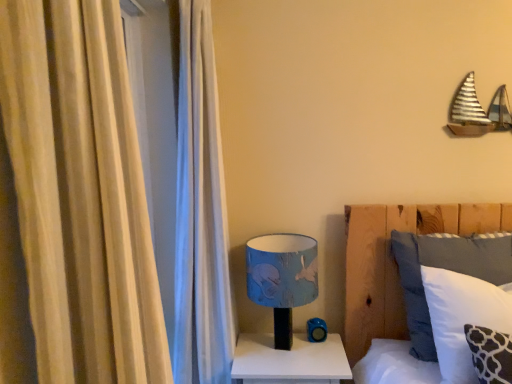
Question: Would you say white glossy nightstand at lower center contains white soft pillow at center?

Choices:
 (A) no
 (B) yes

Answer: (A)

Question: Considering the relative sizes of white glossy nightstand at lower center and white soft pillow at center in the image provided, is white glossy nightstand at lower center wider than white soft pillow at center?

Choices:
 (A) yes
 (B) no

Answer: (A)

Question: From the image's perspective, is white glossy nightstand at lower center on top of white soft pillow at center?

Choices:
 (A) no
 (B) yes

Answer: (A)

Question: Is white glossy nightstand at lower center taller than white soft pillow at center?

Choices:
 (A) no
 (B) yes

Answer: (A)

Question: Is white glossy nightstand at lower center turned away from white soft pillow at center?

Choices:
 (A) yes
 (B) no

Answer: (B)

Question: Based on their positions, is white glossy nightstand at lower center located to the left or right of white soft pillow at center?

Choices:
 (A) right
 (B) left

Answer: (B)

Question: From a real-world perspective, relative to white soft pillow at center, is white glossy nightstand at lower center vertically above or below?

Choices:
 (A) below
 (B) above

Answer: (A)

Question: In terms of height, does white glossy nightstand at lower center look taller or shorter compared to white soft pillow at center?

Choices:
 (A) short
 (B) tall

Answer: (A)

Question: From the image's perspective, is white glossy nightstand at lower center located above or below white soft pillow at center?

Choices:
 (A) above
 (B) below

Answer: (B)

Question: In the image, is blue fabric lampshade at center positioned in front of or behind beige fabric curtain at left?

Choices:
 (A) behind
 (B) front

Answer: (A)

Question: From the image's perspective, relative to beige fabric curtain at left, is blue fabric lampshade at center above or below?

Choices:
 (A) above
 (B) below

Answer: (B)

Question: In terms of height, does blue fabric lampshade at center look taller or shorter compared to beige fabric curtain at left?

Choices:
 (A) tall
 (B) short

Answer: (B)

Question: Looking at the image, does blue fabric lampshade at center seem bigger or smaller compared to beige fabric curtain at left?

Choices:
 (A) big
 (B) small

Answer: (B)

Question: Considering their positions, is white soft pillow at center located in front of or behind blue fabric lampshade at center?

Choices:
 (A) front
 (B) behind

Answer: (A)

Question: From a real-world perspective, is white soft pillow at center above or below blue fabric lampshade at center?

Choices:
 (A) below
 (B) above

Answer: (B)